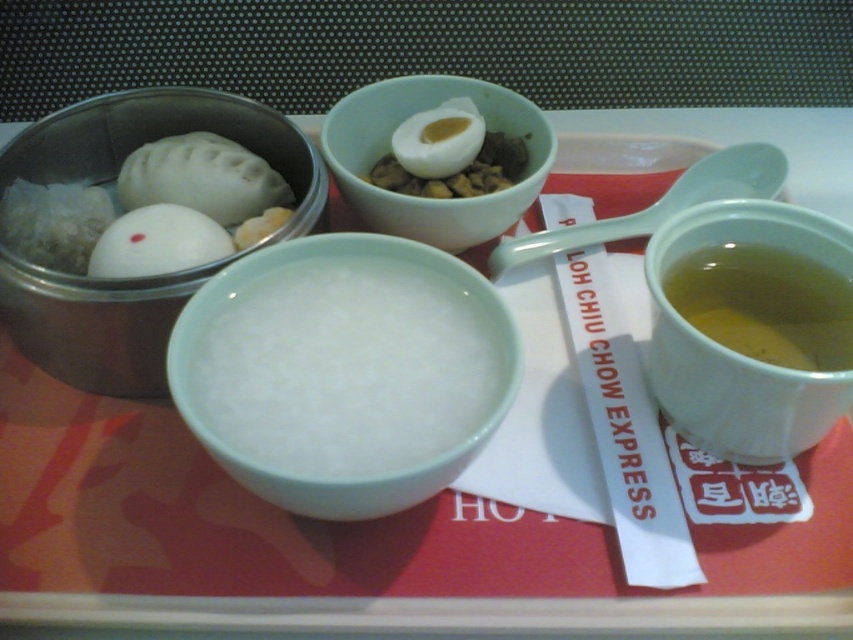
Can you confirm if matte white dumpling at left is wider than matte white egg at center?

Yes, matte white dumpling at left is wider than matte white egg at center.

Does matte white dumpling at left have a lesser height compared to matte white egg at center?

Yes, matte white dumpling at left is shorter than matte white egg at center.

Where is `matte white dumpling at left`? Image resolution: width=853 pixels, height=640 pixels. matte white dumpling at left is located at coordinates (201, 179).

Who is lower down, white matte rice porridge at center or matte white dumpling at left?

Positioned lower is white matte rice porridge at center.

From the picture: Does white matte rice porridge at center lie behind matte white dumpling at left?

No, it is in front of matte white dumpling at left.

From the picture: Who is more forward, (206, 115) or (270, 177)?

Point (270, 177)

At what (x,y) coordinates should I click in order to perform the action: click on white matte rice porridge at center. Please return your answer as a coordinate pair (x, y). The width and height of the screenshot is (853, 640). Looking at the image, I should click on (161, 136).

Is translucent ceramic cup at right below matte ceramic bowl at center?

Indeed, translucent ceramic cup at right is positioned under matte ceramic bowl at center.

Who is positioned more to the right, translucent ceramic cup at right or matte ceramic bowl at center?

translucent ceramic cup at right

Who is more forward, (x=705, y=422) or (x=538, y=109)?

Positioned in front is point (x=705, y=422).

Find the location of a particular element. The image size is (853, 640). translucent ceramic cup at right is located at coordinates (740, 353).